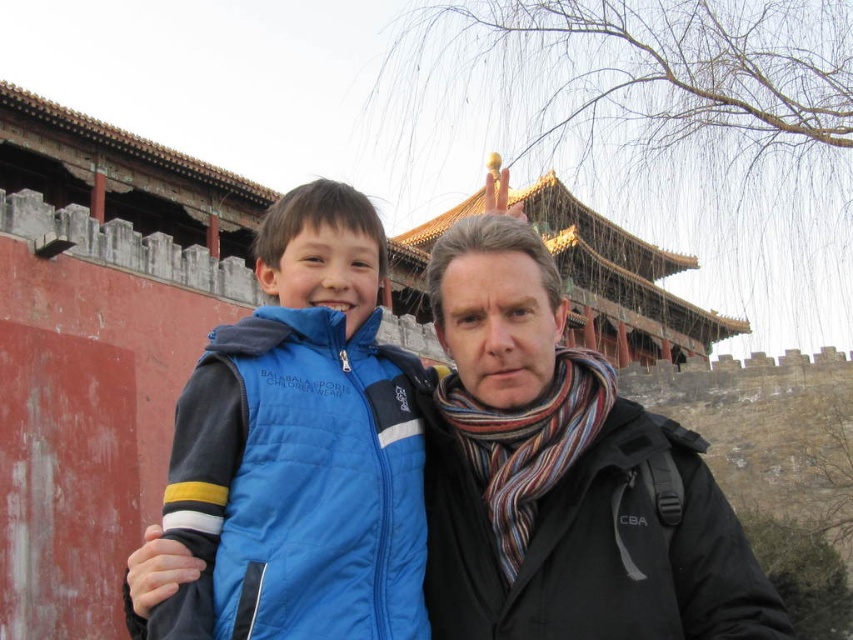
You are a photographer taking a picture of two tourists at the Forbidden City. You notice the matte black jacket at center and the blue puffer vest at center. Which clothing item is closer to the camera?

The matte black jacket at center is closer to the camera because the blue puffer vest at center is behind it.

You are a tour guide explaining the Forbidden City to visitors. You point to two points on the building wall. The first point is at coordinates point (x=467, y=572) and the second is at point (x=306, y=627). Which point is closer to the visitors?

Point (x=467, y=572) is closer to the visitors because it is further to the viewer than point (x=306, y=627).

You are standing in front of a traditional Chinese building with a red wall. You see a point at coordinate (564, 476). What object is located at that point?

The point at coordinate (564, 476) corresponds to the matte black jacket at center.